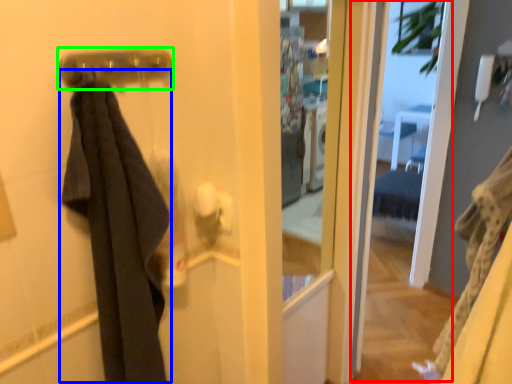
Question: Based on their relative distances, which object is nearer to screen door (highlighted by a red box)? Choose from clothing (highlighted by a blue box) and door handle (highlighted by a green box).

Choices:
 (A) clothing
 (B) door handle

Answer: (A)